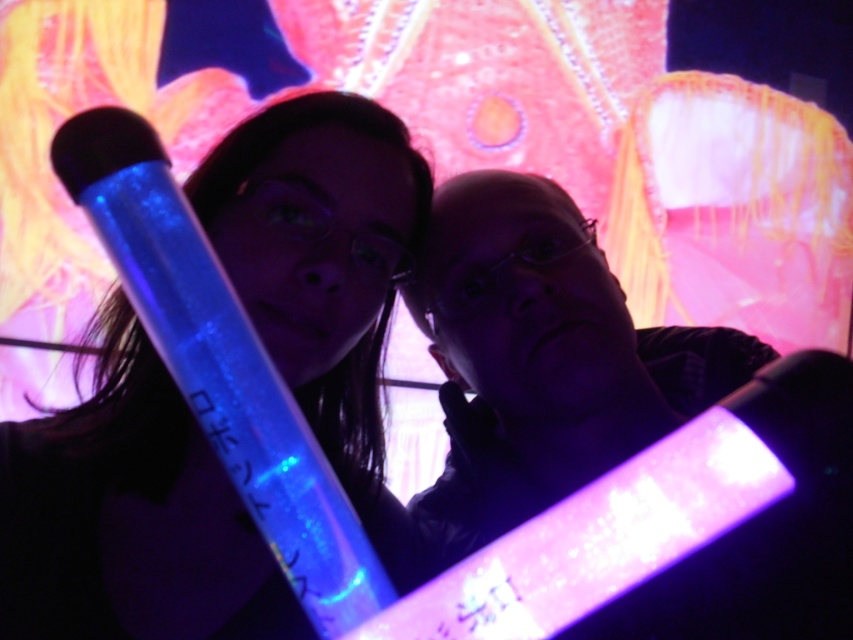
Question: Which point is closer to the camera?

Choices:
 (A) glowing plastic stick at center
 (B) translucent plastic tube at center

Answer: (A)

Question: Does glowing plastic stick at center have a lesser width compared to translucent plastic tube at center?

Choices:
 (A) yes
 (B) no

Answer: (A)

Question: Among these objects, which one is nearest to the camera?

Choices:
 (A) translucent plastic tube at center
 (B) glowing plastic stick at center

Answer: (B)

Question: Observing the image, what is the correct spatial positioning of glowing plastic stick at center in reference to translucent plastic tube at center?

Choices:
 (A) right
 (B) left

Answer: (B)

Question: Is glowing plastic stick at center to the right of translucent plastic tube at center from the viewer's perspective?

Choices:
 (A) no
 (B) yes

Answer: (A)